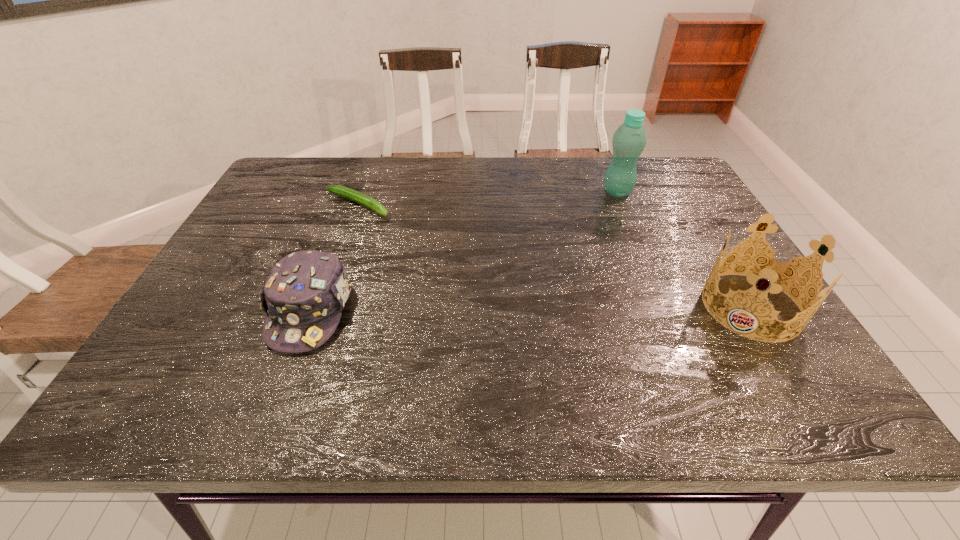
The height and width of the screenshot is (540, 960). Identify the location of free space on the desktop that is between the headwear and the crown and is positioned at the front cap of the tallest object. (541, 308).

Locate an element on the screen. vacant space on the desktop that is between the headwear and the crown and is positioned on the front-facing side of the zucchini is located at coordinates (576, 308).